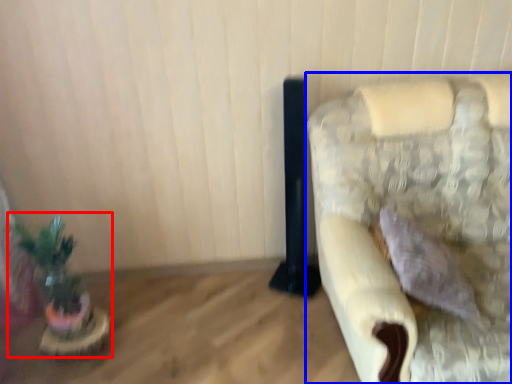
Question: Which of the following is the farthest to the observer, houseplant (highlighted by a red box) or furniture (highlighted by a blue box)?

Choices:
 (A) houseplant
 (B) furniture

Answer: (A)